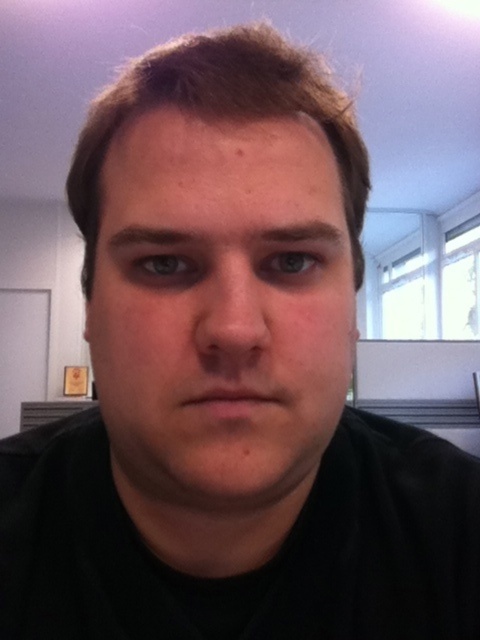
Question: Which point is closer to the camera taking this photo?

Choices:
 (A) (200, 180)
 (B) (308, 237)
 (C) (219, 93)

Answer: (A)

Question: Which point is farther from the camera taking this photo?

Choices:
 (A) [268, 307]
 (B) [344, 275]
 (C) [264, 61]
 (D) [140, 228]

Answer: (B)

Question: Which of the following is the farthest from the observer?

Choices:
 (A) smooth skin face at center
 (B) dark brown eyebrow at upper center
 (C) brown matte hair at center

Answer: (C)

Question: Can you confirm if smooth skin face at center is positioned below brown matte hair at center?

Choices:
 (A) yes
 (B) no

Answer: (A)

Question: Is smooth skin face at center thinner than matte skin nose at center?

Choices:
 (A) no
 (B) yes

Answer: (A)

Question: Observing the image, what is the correct spatial positioning of smooth skin face at center in reference to dark brown hair at center?

Choices:
 (A) below
 (B) above

Answer: (A)